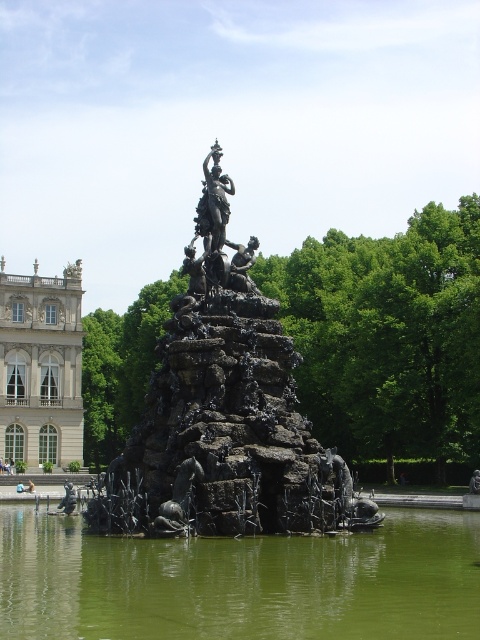
You are standing at the point with coordinates point (225, 429) in the image. What object are you standing on?

You are standing on the black metal fountain at center.

You are standing in the garden and want to take a photo of the white marble palace at left and the bronze statue at center. Which object will appear higher in your camera view?

The bronze statue at center appears higher in the camera view because the white marble palace at left is located below it.